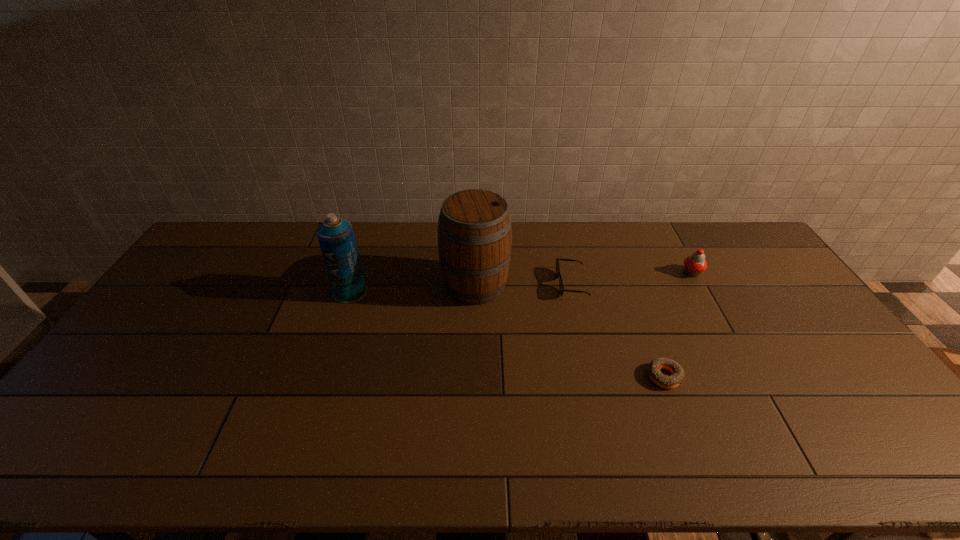
The image size is (960, 540). Find the location of `vacant space that is in between the fourth tallest object and the second object from right to left`. vacant space that is in between the fourth tallest object and the second object from right to left is located at coordinates (618, 330).

Where is `free point between the cider and the cupcake`? free point between the cider and the cupcake is located at coordinates (584, 279).

The width and height of the screenshot is (960, 540). I want to click on free point between the sunglasses and the cider, so click(x=523, y=285).

Image resolution: width=960 pixels, height=540 pixels. What are the coordinates of `vacant space that's between the cupcake and the shortest object` in the screenshot? It's located at (678, 325).

At what (x,y) coordinates should I click in order to perform the action: click on vacant area between the shortest object and the cider. Please return your answer as a coordinate pair (x, y). This screenshot has height=540, width=960. Looking at the image, I should click on (569, 330).

This screenshot has height=540, width=960. I want to click on empty space between the shortest object and the cupcake, so click(678, 325).

Find the location of a particular element. The height and width of the screenshot is (540, 960). unoccupied area between the cider and the rightmost object is located at coordinates (584, 279).

Locate an element on the screen. The image size is (960, 540). vacant region between the cider and the cupcake is located at coordinates (584, 279).

Locate an element on the screen. The width and height of the screenshot is (960, 540). free spot between the shortest object and the rightmost object is located at coordinates (678, 325).

Locate which object is the second closest to the third tallest object. Please provide its 2D coordinates. Your answer should be formatted as a tuple, i.e. [(x, y)], where the tuple contains the x and y coordinates of a point satisfying the conditions above.

[(654, 372)]